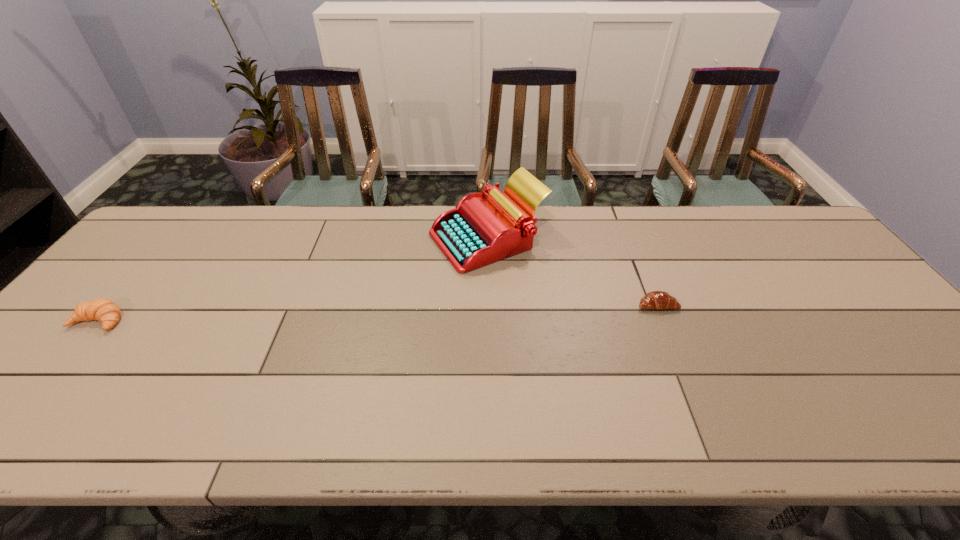
Locate an element on the screen. This screenshot has width=960, height=540. free space between the left crescent roll and the shortest object is located at coordinates (378, 313).

Find the location of a particular element. This screenshot has width=960, height=540. blank region between the taller crescent roll and the second object from right to left is located at coordinates (294, 280).

This screenshot has width=960, height=540. I want to click on unoccupied position between the right crescent roll and the leftmost object, so click(x=378, y=313).

Find the location of `unoccupied area between the right crescent roll and the farthest object`. unoccupied area between the right crescent roll and the farthest object is located at coordinates (572, 272).

At what (x,y) coordinates should I click in order to perform the action: click on empty location between the taller crescent roll and the tallest object. Please return your answer as a coordinate pair (x, y). Looking at the image, I should click on (294, 280).

Image resolution: width=960 pixels, height=540 pixels. In order to click on free space between the typewriter and the rightmost object in this screenshot , I will do `click(572, 272)`.

The image size is (960, 540). I want to click on vacant point located between the tallest object and the leftmost object, so click(x=294, y=280).

Find the location of a particular element. The height and width of the screenshot is (540, 960). free point between the shortest object and the typewriter is located at coordinates (572, 272).

Where is `the second closest object to the second object from right to left`? the second closest object to the second object from right to left is located at coordinates (104, 310).

Where is `object that is the closest to the shortest object`? This screenshot has height=540, width=960. object that is the closest to the shortest object is located at coordinates (477, 232).